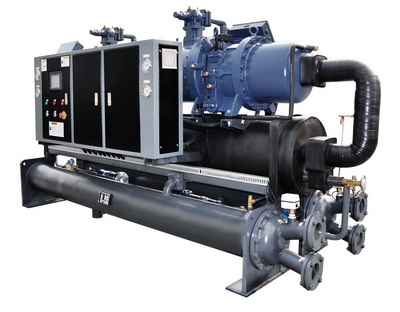
Find the location of a particular element. This screenshot has height=312, width=400. small white box attached to pipe on lower right corner is located at coordinates (294, 197).